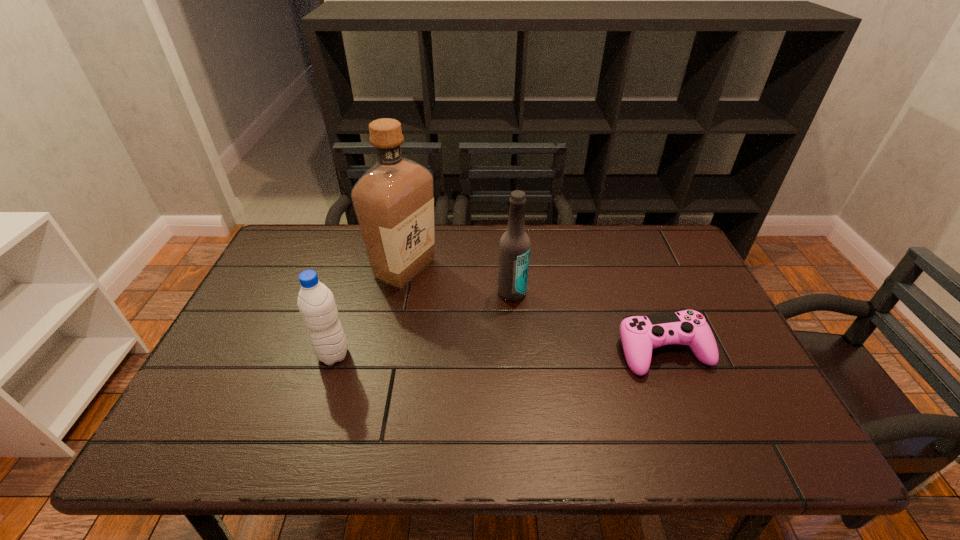
The image size is (960, 540). In order to click on the second shortest object in this screenshot , I will do `click(316, 303)`.

Identify the location of the shortest object. This screenshot has width=960, height=540. [640, 334].

At what (x,y) coordinates should I click in order to perform the action: click on control. Please return your answer as a coordinate pair (x, y). Looking at the image, I should click on (640, 334).

In order to click on the tallest object in this screenshot , I will do `click(393, 201)`.

Locate an element on the screen. the second tallest object is located at coordinates (514, 247).

Image resolution: width=960 pixels, height=540 pixels. Find the location of `beer bottle`. beer bottle is located at coordinates (514, 247).

This screenshot has height=540, width=960. I want to click on vacant space located 0.150m on the back of the second shortest object, so click(350, 302).

Where is `vacant space situated 0.280m on the left of the control`? vacant space situated 0.280m on the left of the control is located at coordinates (507, 352).

You are a GUI agent. You are given a task and a screenshot of the screen. Output one action in this format:
    pyautogui.click(x=<x>, y=<y>)
    Task: Click on the free space located on the front-facing side of the liquor
    
    Given the screenshot: What is the action you would take?
    pyautogui.click(x=429, y=313)

Where is `vacant space situated on the front-facing side of the liquor`? The image size is (960, 540). vacant space situated on the front-facing side of the liquor is located at coordinates (445, 343).